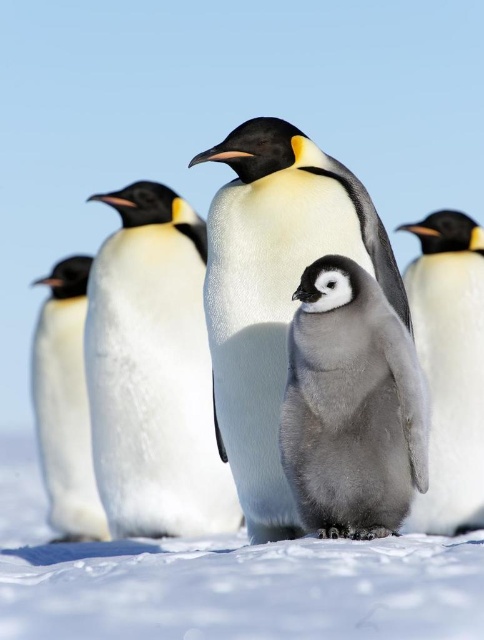
You are a wildlife photographer aiming to capture a closeup shot of both the white smooth penguin at center and the gray downy penguin at center. Since you want to ensure both are in focus, you need to know which one is bigger. Which penguin is larger?

The white smooth penguin at center is larger compared to the gray downy penguin at center, so you should adjust your camera settings to accommodate its size while keeping both in focus.

You are a wildlife photographer observing emperor penguins. You notice a gray downy penguin at center and a white fluffy penguin at right. Which penguin has a smaller body width?

The gray downy penguin at center is thinner than the white fluffy penguin at right, so the gray downy penguin at center has a smaller body width.

You are a researcher observing emperor penguins in their natural habitat. You notice a specific point marked at coordinates (351, 406). What is the significance of this point in relation to the gray downy penguin at center?

The point at (351, 406) marks the location of the gray downy penguin at center.